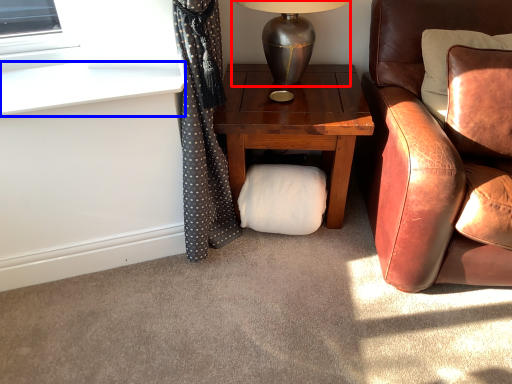
Question: Which of the following is the closest to the observer, table lamp (highlighted by a red box) or window sill (highlighted by a blue box)?

Choices:
 (A) table lamp
 (B) window sill

Answer: (B)